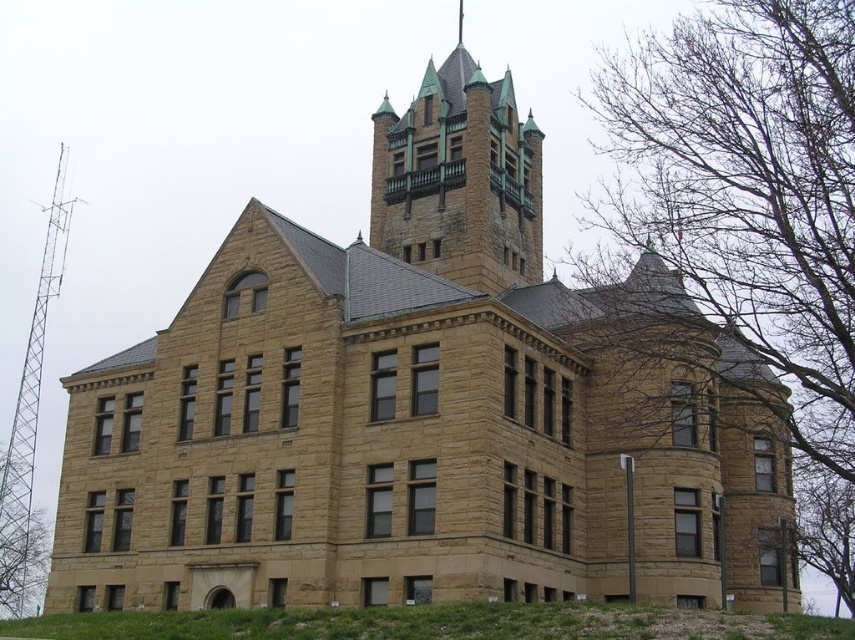
You are standing in front of the historic stone building and notice the bare branches at right and the green copper spires at upper center. Which object is closer to you?

The bare branches at right is closer to the viewer than the green copper spires at upper center.

You are standing in front of the historic stone building and want to take a photo of the tower. There are bare branches at right in the frame. Where should you move to avoid them?

You should move to the left to avoid the bare branches at right, which are positioned at point 0.294 on the horizontal axis and 0.874 on the vertical axis.

You are an architect inspecting the building from the ground. You notice the bare branches at right and the green copper spires at upper center. Which of these two objects appears bigger in the image?

The bare branches at right has a larger size compared to green copper spires at upper center, so the bare branches at right appears bigger in the image.